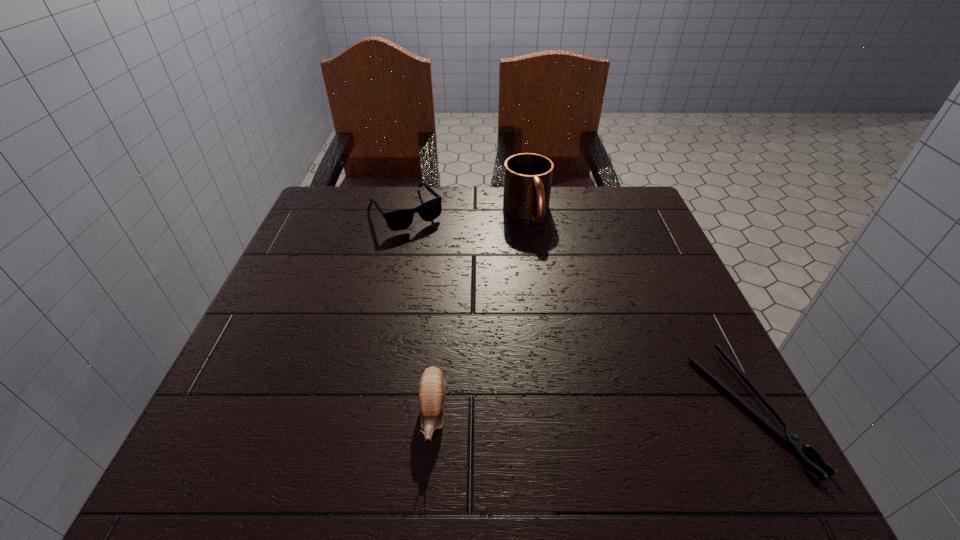
The width and height of the screenshot is (960, 540). Find the location of `vacant space that satisfies the following two spatial constraints: 1. on the front side of the third tallest object; 2. on the left side of the third object from left to right`. vacant space that satisfies the following two spatial constraints: 1. on the front side of the third tallest object; 2. on the left side of the third object from left to right is located at coordinates (405, 212).